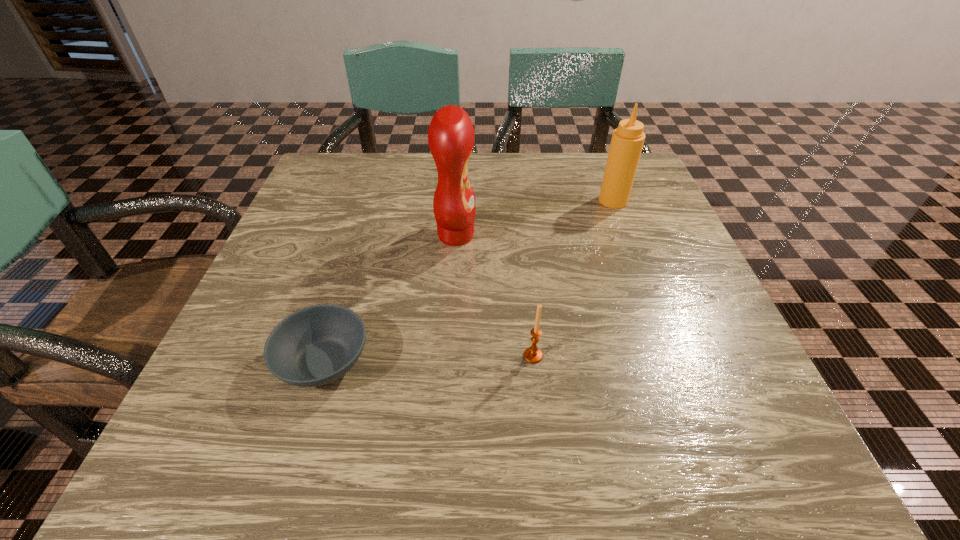
Locate an element on the screen. free space that satisfies the following two spatial constraints: 1. on the back side of the candle_holder; 2. on the right side of the third shortest object is located at coordinates (516, 201).

Where is `free point that satisfies the following two spatial constraints: 1. on the back side of the candle_holder; 2. on the label side of the third nearest object`? The image size is (960, 540). free point that satisfies the following two spatial constraints: 1. on the back side of the candle_holder; 2. on the label side of the third nearest object is located at coordinates (520, 235).